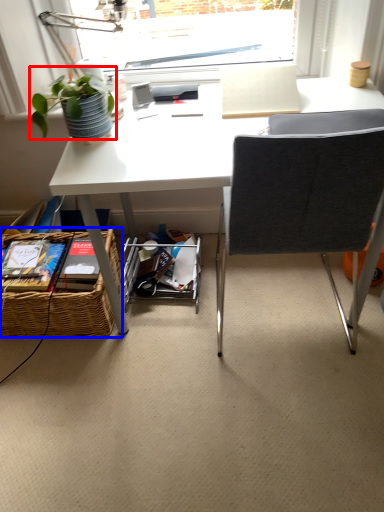
Question: Which object appears closest to the camera in this image, plant (highlighted by a red box) or picnic basket (highlighted by a blue box)?

Choices:
 (A) plant
 (B) picnic basket

Answer: (A)